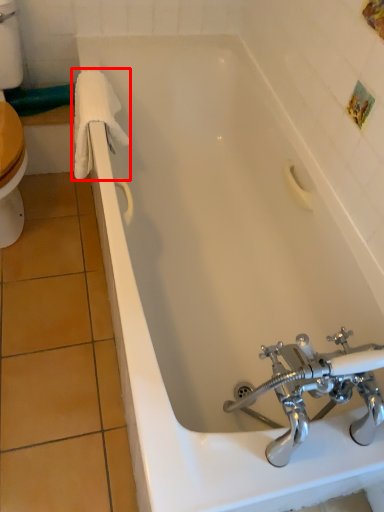
Question: Observing the image, what is the correct spatial positioning of bath towel (annotated by the red box) in reference to tap?

Choices:
 (A) right
 (B) left

Answer: (B)